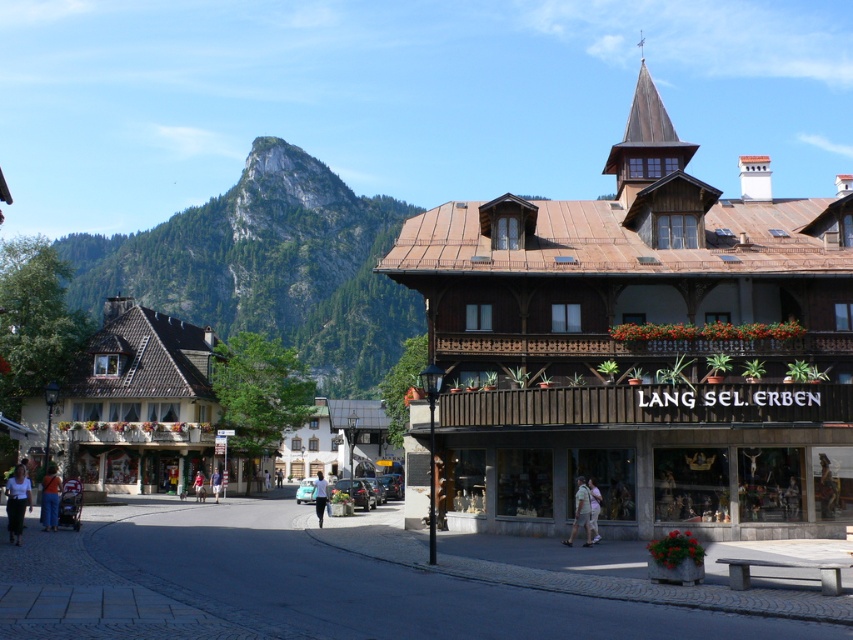
Which of these two, rocky cliff at upper left or light blue jeans at center, stands shorter?

With less height is light blue jeans at center.

Can you confirm if rocky cliff at upper left is wider than light blue jeans at center?

Yes, rocky cliff at upper left is wider than light blue jeans at center.

Is point (99, 240) positioned in front of point (195, 484)?

That is False.

At what (x,y) coordinates should I click in order to perform the action: click on rocky cliff at upper left. Please return your answer as a coordinate pair (x, y). This screenshot has height=640, width=853. Looking at the image, I should click on (270, 268).

Can you confirm if light beige shorts at lower center is smaller than light beige cotton pants at lower center?

Incorrect, light beige shorts at lower center is not smaller in size than light beige cotton pants at lower center.

Is light beige shorts at lower center to the left of light beige cotton pants at lower center from the viewer's perspective?

Indeed, light beige shorts at lower center is positioned on the left side of light beige cotton pants at lower center.

Does point (575, 492) come in front of point (589, 486)?

No, it is not.

Locate an element on the screen. light beige shorts at lower center is located at coordinates [579, 513].

Can you confirm if light beige cotton pants at lower center is shorter than light blue shirt at center?

Correct, light beige cotton pants at lower center is not as tall as light blue shirt at center.

Is point (595, 534) more distant than point (321, 476)?

No, it is not.

Which is behind, point (596, 540) or point (316, 493)?

Positioned behind is point (316, 493).

I want to click on light beige cotton pants at lower center, so click(595, 508).